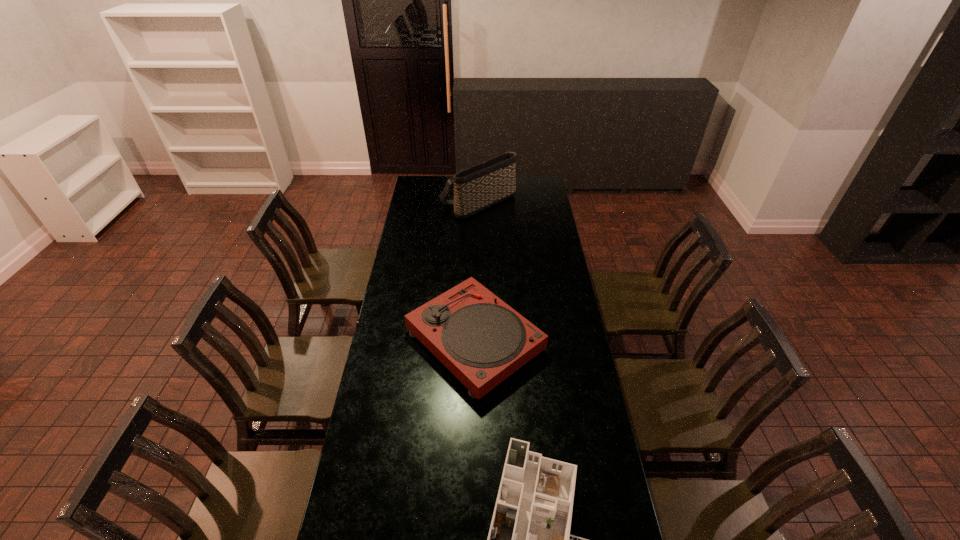
Image resolution: width=960 pixels, height=540 pixels. Find the location of `the tallest object`. the tallest object is located at coordinates tap(479, 187).

I want to click on handbag, so click(x=479, y=187).

This screenshot has width=960, height=540. In order to click on the second farthest object in this screenshot , I will do `click(481, 340)`.

Where is `the second tallest object`? Image resolution: width=960 pixels, height=540 pixels. the second tallest object is located at coordinates pyautogui.click(x=481, y=340).

Locate an element on the screen. The image size is (960, 540). vacant region located on the left of the farthest object is located at coordinates (429, 203).

Find the location of a particular element. vacant space located on the front of the record player is located at coordinates click(x=473, y=436).

In order to click on object that is positioned at the far edge in this screenshot , I will do `click(479, 187)`.

The height and width of the screenshot is (540, 960). Identify the location of object that is at the left edge. (481, 340).

The image size is (960, 540). In order to click on object at the right edge in this screenshot , I will do `click(481, 340)`.

The image size is (960, 540). Find the location of `vacant area at the left edge`. vacant area at the left edge is located at coordinates (402, 265).